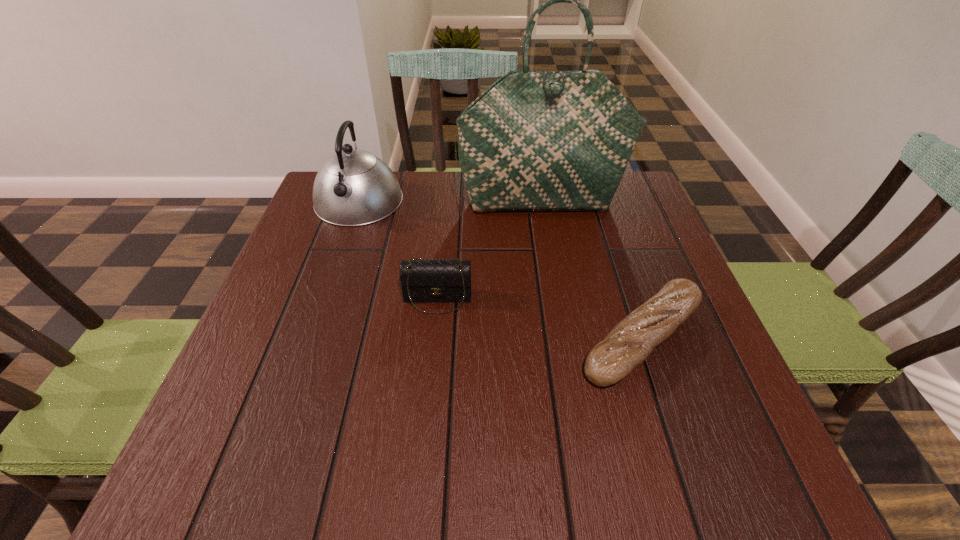
The image size is (960, 540). I want to click on vacant area that satisfies the following two spatial constraints: 1. from the spout of the shortest object; 2. on the left side of the leftmost object, so click(311, 338).

Locate an element on the screen. blank space that satisfies the following two spatial constraints: 1. from the spout of the tote bag; 2. on the left side of the leftmost object is located at coordinates (358, 202).

Identify the location of free space that satisfies the following two spatial constraints: 1. from the spout of the leftmost object; 2. on the left side of the shortest object. (311, 338).